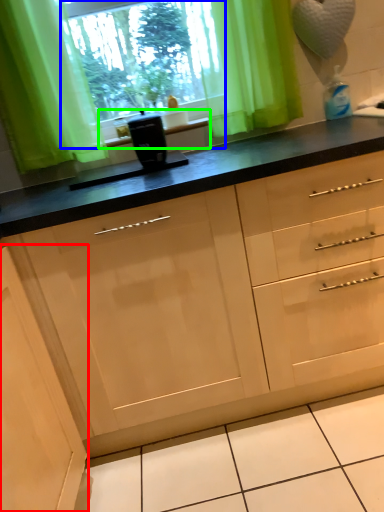
Question: Considering the real-world distances, which object is closest to cabinetry (highlighted by a red box)? window screen (highlighted by a blue box) or window sill (highlighted by a green box).

Choices:
 (A) window screen
 (B) window sill

Answer: (B)